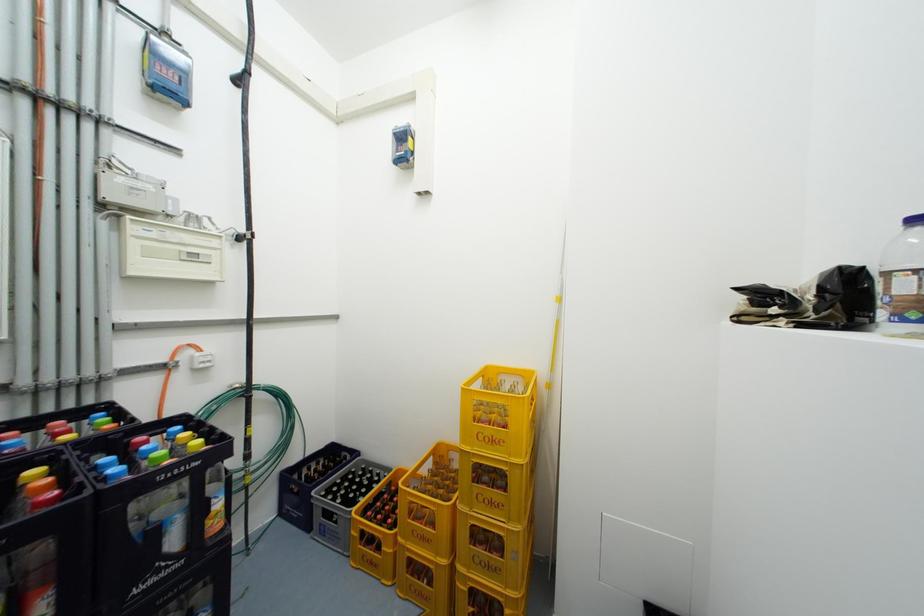
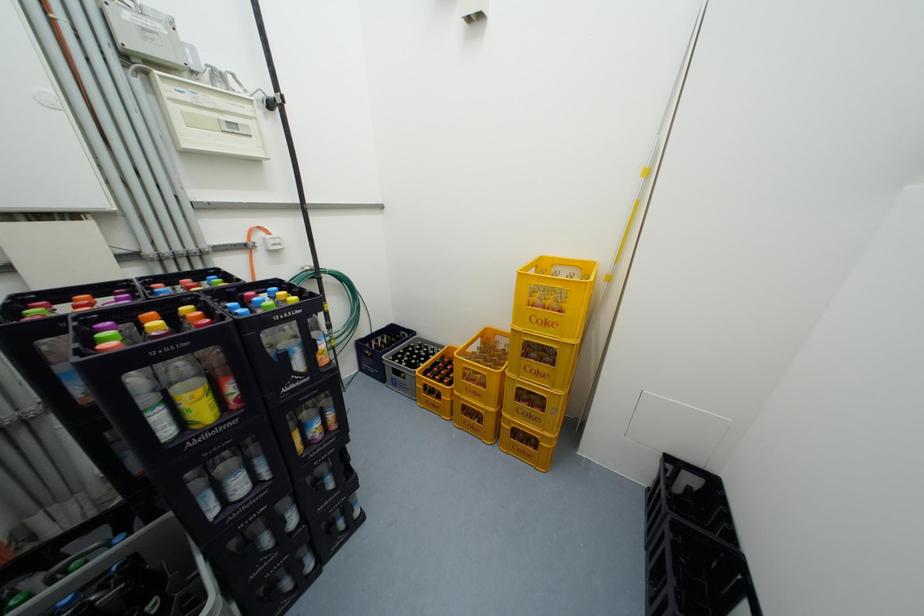
Question: The first image is from the beginning of the video and the second image is from the end. How did the camera likely rotate when shooting the video?

Choices:
 (A) Left
 (B) Right
 (C) Up
 (D) Down

Answer: (D)